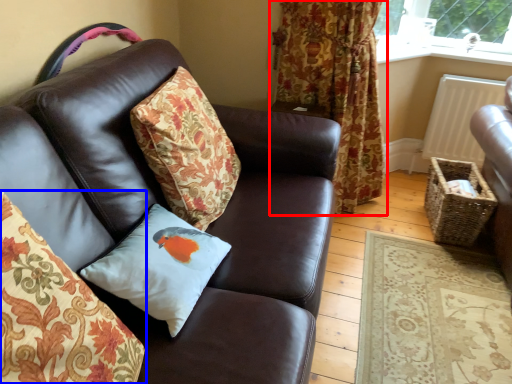
Question: Among these objects, which one is nearest to the camera, curtain (highlighted by a red box) or pillow (highlighted by a blue box)?

Choices:
 (A) curtain
 (B) pillow

Answer: (B)